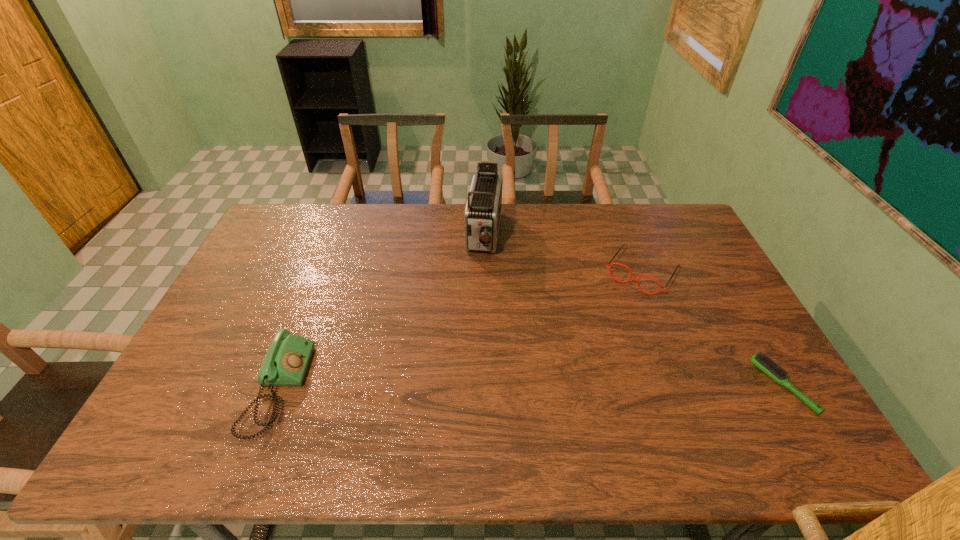
Find the location of a particular element. the leftmost object is located at coordinates (285, 364).

This screenshot has width=960, height=540. What are the coordinates of `the third shortest object` in the screenshot? It's located at point(285,364).

Where is `the rightmost object`? The image size is (960, 540). the rightmost object is located at coordinates (763, 362).

Locate an element on the screen. the shortest object is located at coordinates (763, 362).

The height and width of the screenshot is (540, 960). Identify the location of the third tallest object. (631, 277).

Identify the location of the second object from right to left. Image resolution: width=960 pixels, height=540 pixels. (631, 277).

The image size is (960, 540). Find the location of `camcorder`. camcorder is located at coordinates (482, 213).

The image size is (960, 540). In order to click on the third object from right to left in this screenshot , I will do `click(482, 213)`.

Identify the location of blank area located 0.230m on the dial of the second tallest object. (392, 389).

Find the location of a particular element. The height and width of the screenshot is (540, 960). vacant region located on the back of the hairbrush is located at coordinates (746, 322).